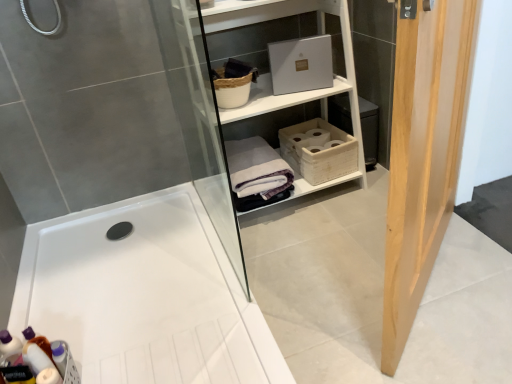
Describe the element at coordinates (233, 87) in the screenshot. I see `woven brown basket at upper center, arranged as the first basket when viewed from the top` at that location.

Describe the element at coordinates (318, 152) in the screenshot. The height and width of the screenshot is (384, 512). I see `white woven basket at center, marked as the 1th basket in a right-to-left arrangement` at that location.

In order to face white cotton bath towel at center, should I rotate leftwards or rightwards?

You should rotate left by 0.096 degrees.

The image size is (512, 384). What do you see at coordinates (144, 296) in the screenshot? I see `white glossy bathtub at center` at bounding box center [144, 296].

Identify the location of woven brown basket at upper center, placed as the first basket when sorted from left to right. The image size is (512, 384). (233, 87).

Which object is wider, white woven basket at center, which is the 1th basket in bottom-to-top order, or translucent plastic bottles at lower left?

With larger width is white woven basket at center, which is the 1th basket in bottom-to-top order.

Is white woven basket at center, the 2th basket from the left, to the right of translucent plastic bottles at lower left from the viewer's perspective?

Correct, you'll find white woven basket at center, the 2th basket from the left, to the right of translucent plastic bottles at lower left.

From a real-world perspective, between white woven basket at center, which is the 1th basket in bottom-to-top order, and translucent plastic bottles at lower left, who is vertically higher?

white woven basket at center, which is the 1th basket in bottom-to-top order, is physically above.

Does white woven basket at center, marked as the 1th basket in a right-to-left arrangement, have a smaller size compared to translucent plastic bottles at lower left?

No.

Is white glossy bathtub at center positioned far away from white woven basket at center, which is the 1th basket in bottom-to-top order?

Actually, white glossy bathtub at center and white woven basket at center, which is the 1th basket in bottom-to-top order, are a little close together.

Which is farther from the camera, (216, 307) or (333, 155)?

The point (333, 155) is farther from the camera.

Is white glossy bathtub at center to the left or to the right of white woven basket at center, the 2th basket from the left, in the image?

Clearly, white glossy bathtub at center is on the left of white woven basket at center, the 2th basket from the left, in the image.

Is white glossy bathtub at center surrounded by white woven basket at center, acting as the 2th basket starting from the top?

Definitely not — white glossy bathtub at center is not inside white woven basket at center, acting as the 2th basket starting from the top.

Is point (315, 160) closer or farther from the camera than point (198, 282)?

Point (315, 160) is farther from the camera than point (198, 282).

Does white woven basket at center, which is the 1th basket in bottom-to-top order, turn towards white glossy bathtub at center?

No, white woven basket at center, which is the 1th basket in bottom-to-top order, does not turn towards white glossy bathtub at center.

Based on their sizes in the image, would you say white woven basket at center, acting as the 2th basket starting from the top, is bigger or smaller than white glossy bathtub at center?

white woven basket at center, acting as the 2th basket starting from the top, is smaller than white glossy bathtub at center.

Considering the relative sizes of white matte shelf at upper center and light wood door at right in the image provided, is white matte shelf at upper center smaller than light wood door at right?

No.

Is white matte shelf at upper center positioned beyond the bounds of light wood door at right?

white matte shelf at upper center lies outside light wood door at right's area.

Is the position of white matte shelf at upper center less distant than that of light wood door at right?

That is False.

From the image's perspective, which is above, white matte shelf at upper center or light wood door at right?

white matte shelf at upper center, from the image's perspective.

Is white glossy bathtub at center looking in the opposite direction of light wood door at right?

No, white glossy bathtub at center's orientation is not away from light wood door at right.

Considering the relative positions of white glossy bathtub at center and light wood door at right in the image provided, is white glossy bathtub at center in front of light wood door at right?

No, it is behind light wood door at right.

From a real-world perspective, is white glossy bathtub at center located beneath light wood door at right?

Yes, from a real-world perspective, white glossy bathtub at center is under light wood door at right.

Considering the relative sizes of white cotton bath towel at center and white matte shelf at upper center in the image provided, is white cotton bath towel at center thinner than white matte shelf at upper center?

Incorrect, the width of white cotton bath towel at center is not less than that of white matte shelf at upper center.

Who is smaller, white cotton bath towel at center or white matte shelf at upper center?

white cotton bath towel at center.

Does white cotton bath towel at center have a greater height compared to white matte shelf at upper center?

No.

Does white cotton bath towel at center appear on the right side of white matte shelf at upper center?

→ In fact, white cotton bath towel at center is to the left of white matte shelf at upper center.

Is white cotton bath towel at center positioned beyond the bounds of white woven basket at center, acting as the 2th basket starting from the top?

Yes, white cotton bath towel at center is outside of white woven basket at center, acting as the 2th basket starting from the top.

Considering the relative sizes of white cotton bath towel at center and white woven basket at center, the 2th basket from the left, in the image provided, is white cotton bath towel at center taller than white woven basket at center, the 2th basket from the left,?

Correct, white cotton bath towel at center is much taller as white woven basket at center, the 2th basket from the left.

Which is behind, point (275, 194) or point (341, 154)?

Positioned behind is point (341, 154).

The image size is (512, 384). I want to click on basket that is the 2nd one when counting rightward from the translucent plastic bottles at lower left, so click(x=318, y=152).

Image resolution: width=512 pixels, height=384 pixels. I want to click on the 2nd basket behind the white glossy bathtub at center, starting your count from the anchor, so (318, 152).

Which object lies nearer to the anchor point woven brown basket at upper center, which ranks as the 2th basket in right-to-left order, translucent plastic bottles at lower left or white woven basket at center, marked as the 1th basket in a right-to-left arrangement?

white woven basket at center, marked as the 1th basket in a right-to-left arrangement.

From the image, which object appears to be farther from white woven basket at center, the 2th basket from the left, white matte shelf at upper center or light wood door at right?

The object further to white woven basket at center, the 2th basket from the left, is light wood door at right.

Estimate the real-world distances between objects in this image. Which object is closer to white woven basket at center, which is the 1th basket in bottom-to-top order, woven brown basket at upper center, which ranks as the 2th basket in right-to-left order, or white cotton bath towel at center?

The object closer to white woven basket at center, which is the 1th basket in bottom-to-top order, is white cotton bath towel at center.

Looking at the image, which one is located further to white woven basket at center, marked as the 1th basket in a right-to-left arrangement, white matte shelf at upper center or white glossy bathtub at center?

The object further to white woven basket at center, marked as the 1th basket in a right-to-left arrangement, is white glossy bathtub at center.

Considering their positions, is woven brown basket at upper center, placed as the first basket when sorted from left to right, positioned further to white woven basket at center, which is the 1th basket in bottom-to-top order, than white glossy bathtub at center?

Based on the image, white glossy bathtub at center appears to be further to white woven basket at center, which is the 1th basket in bottom-to-top order.

Looking at the image, which one is located closer to white cotton bath towel at center, woven brown basket at upper center, placed as the first basket when sorted from left to right, or white matte shelf at upper center?

Among the two, white matte shelf at upper center is located nearer to white cotton bath towel at center.

Based on their spatial positions, is light wood door at right or white glossy bathtub at center closer to woven brown basket at upper center, which ranks as the 2th basket in right-to-left order?

white glossy bathtub at center is positioned closer to the anchor woven brown basket at upper center, which ranks as the 2th basket in right-to-left order.

From the image, which object appears to be nearer to translucent plastic bottles at lower left, white cotton bath towel at center or white woven basket at center, marked as the 1th basket in a right-to-left arrangement?

white cotton bath towel at center is closer to translucent plastic bottles at lower left.

Locate an element on the screen. bath towel between light wood door at right and white woven basket at center, which is the 1th basket in bottom-to-top order, along the z-axis is located at coordinates (257, 168).

The width and height of the screenshot is (512, 384). Identify the location of bath towel between white matte shelf at upper center and translucent plastic bottles at lower left in the up-down direction. (257, 168).

Identify the location of basket between light wood door at right and white cotton bath towel at center along the z-axis. (233, 87).

This screenshot has height=384, width=512. I want to click on toiletry located between white glossy bathtub at center and white cotton bath towel at center in the depth direction, so click(x=38, y=362).